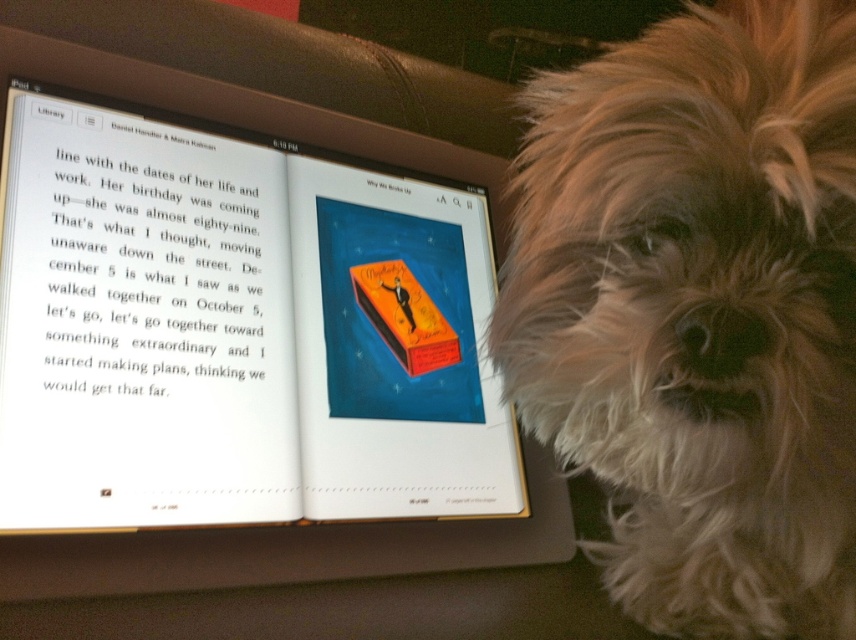
Question: From the image, what is the correct spatial relationship of matte orange book at center in relation to fluffy white fur at right?

Choices:
 (A) below
 (B) above

Answer: (A)

Question: Observing the image, what is the correct spatial positioning of matte orange book at center in reference to fluffy white fur at right?

Choices:
 (A) below
 (B) above

Answer: (A)

Question: Among these objects, which one is nearest to the camera?

Choices:
 (A) matte orange book at center
 (B) fluffy white fur at right

Answer: (B)

Question: Which point is closer to the camera?

Choices:
 (A) fluffy white fur at right
 (B) matte orange book at center

Answer: (A)

Question: Does matte orange book at center come in front of fluffy white fur at right?

Choices:
 (A) yes
 (B) no

Answer: (B)

Question: Which point is farther to the camera?

Choices:
 (A) (634, 248)
 (B) (479, 484)

Answer: (B)